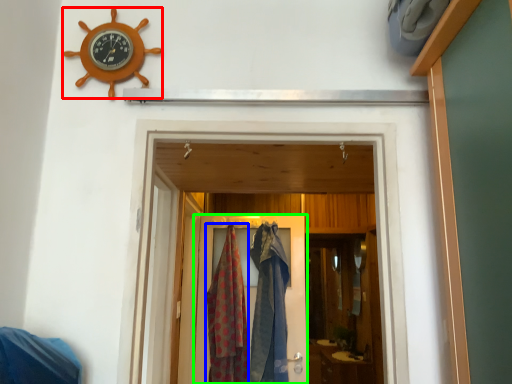
Question: Considering the real-world distances, which object is closest to wall clock (highlighted by a red box)? clothing (highlighted by a blue box) or door (highlighted by a green box).

Choices:
 (A) clothing
 (B) door

Answer: (A)